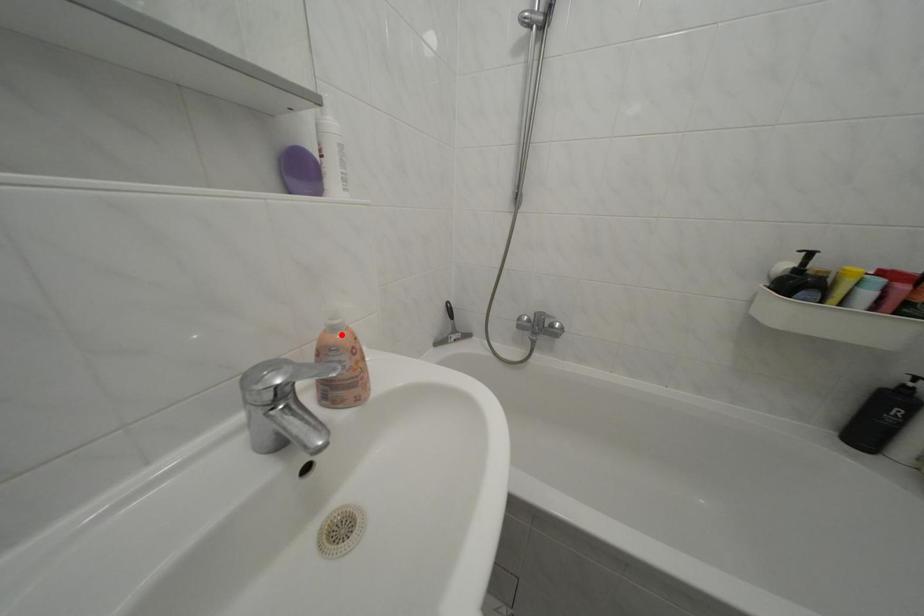
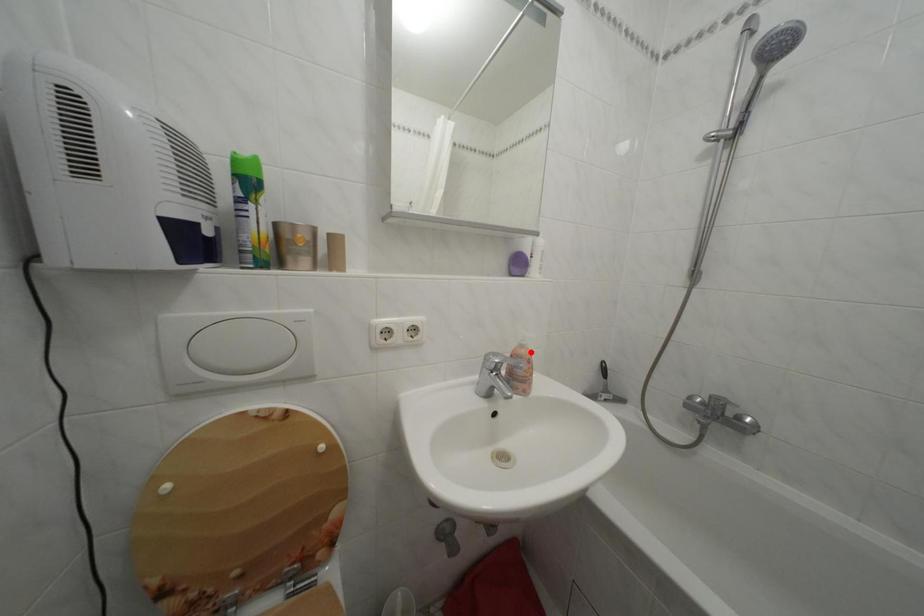
I am providing you with two images of the same scene from different viewpoints. A red point is marked on the first image and another point is marked on the second image. Do the highlighted points in image1 and image2 indicate the same real-world spot?

Yes